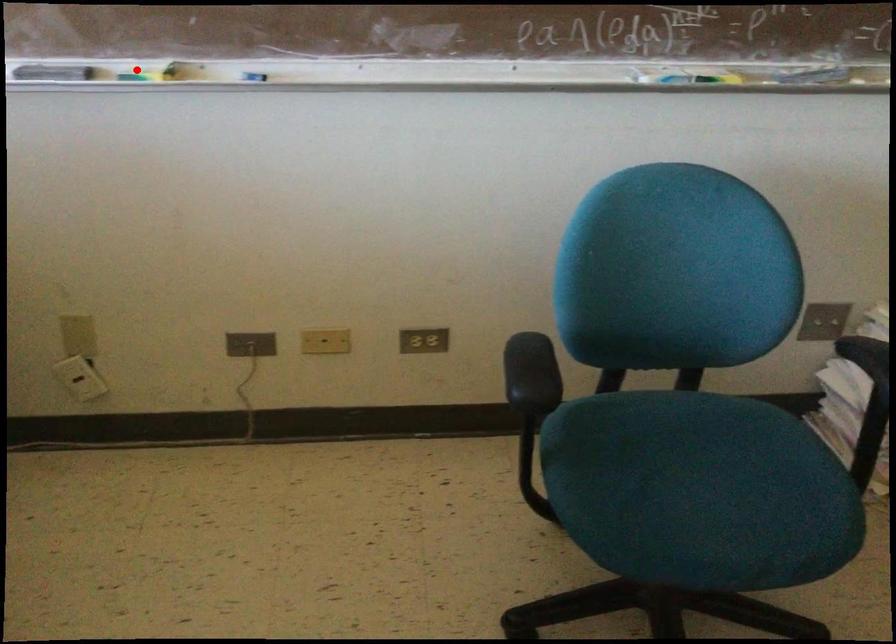
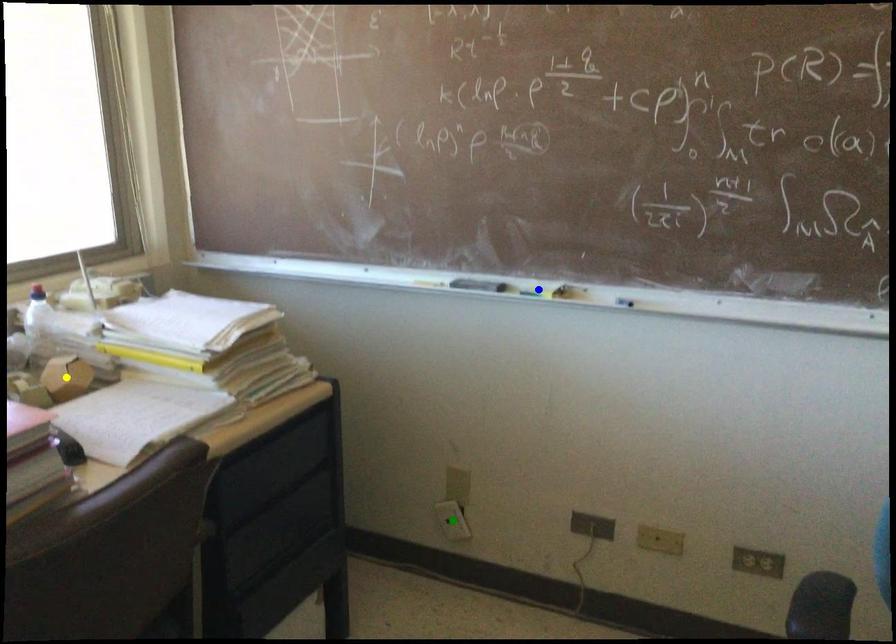
Question: I am providing you with two images of the same scene from different viewpoints. A red point is marked on the first image. You are given multiple points on the second image. Which mark in image 2 goes with the point in image 1?

Choices:
 (A) yellow point
 (B) green point
 (C) blue point

Answer: (C)